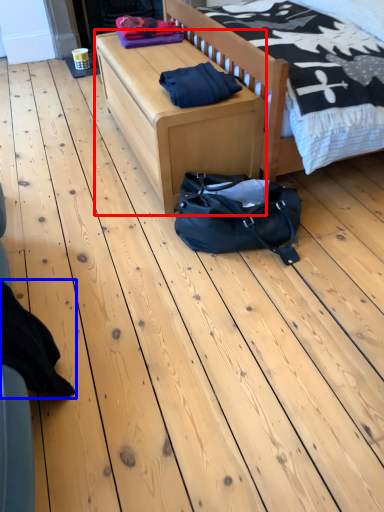
Question: Which point is further to the camera, table (highlighted by a red box) or clothing (highlighted by a blue box)?

Choices:
 (A) table
 (B) clothing

Answer: (A)